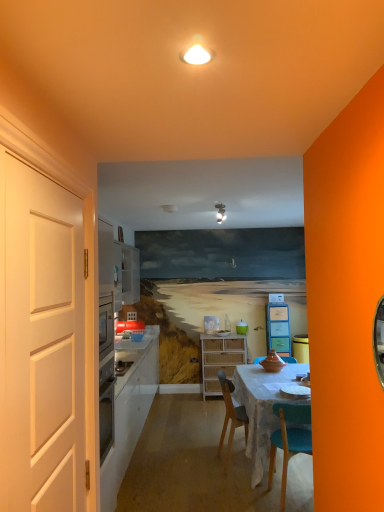
Question: Considering the relative positions of matte white light fixture at upper center and white matte door at left in the image provided, is matte white light fixture at upper center behind white matte door at left?

Choices:
 (A) yes
 (B) no

Answer: (A)

Question: From the image's perspective, is matte white light fixture at upper center over white matte door at left?

Choices:
 (A) yes
 (B) no

Answer: (A)

Question: Does matte white light fixture at upper center have a larger size compared to white matte door at left?

Choices:
 (A) yes
 (B) no

Answer: (B)

Question: Is matte white light fixture at upper center thinner than white matte door at left?

Choices:
 (A) no
 (B) yes

Answer: (A)

Question: Are matte white light fixture at upper center and white matte door at left beside each other?

Choices:
 (A) no
 (B) yes

Answer: (A)

Question: From the image's perspective, is woven wood cabinet at center, the 2th cabinetry viewed from the right, above or below matte plastic cabinet at center, which is the 1th cabinetry in right-to-left order?

Choices:
 (A) below
 (B) above

Answer: (A)

Question: Is woven wood cabinet at center, the 2th cabinetry viewed from the right, in front of or behind matte plastic cabinet at center, which is the 1th cabinetry in right-to-left order, in the image?

Choices:
 (A) front
 (B) behind

Answer: (A)

Question: Visually, is woven wood cabinet at center, the first cabinetry viewed from the left, positioned to the left or to the right of matte plastic cabinet at center, which is the 1th cabinetry in right-to-left order?

Choices:
 (A) right
 (B) left

Answer: (B)

Question: Considering the positions of point (233, 340) and point (284, 321), is point (233, 340) closer or farther from the camera than point (284, 321)?

Choices:
 (A) farther
 (B) closer

Answer: (B)

Question: Relative to matte white light fixture at upper center, is matte plastic cabinet at center, which is counted as the second cabinetry, starting from the left, in front or behind?

Choices:
 (A) front
 (B) behind

Answer: (B)

Question: Is matte plastic cabinet at center, which is the 1th cabinetry in right-to-left order, inside or outside of matte white light fixture at upper center?

Choices:
 (A) outside
 (B) inside

Answer: (A)

Question: Looking at their shapes, would you say matte plastic cabinet at center, which is the 1th cabinetry in right-to-left order, is wider or thinner than matte white light fixture at upper center?

Choices:
 (A) wide
 (B) thin

Answer: (B)

Question: Would you say matte plastic cabinet at center, which is counted as the second cabinetry, starting from the left, is to the left or to the right of matte white light fixture at upper center in the picture?

Choices:
 (A) right
 (B) left

Answer: (A)

Question: Choose the correct answer: Is white matte door at left inside matte white light fixture at upper center or outside it?

Choices:
 (A) inside
 (B) outside

Answer: (B)

Question: Considering the positions of white matte door at left and matte white light fixture at upper center in the image, is white matte door at left bigger or smaller than matte white light fixture at upper center?

Choices:
 (A) big
 (B) small

Answer: (A)